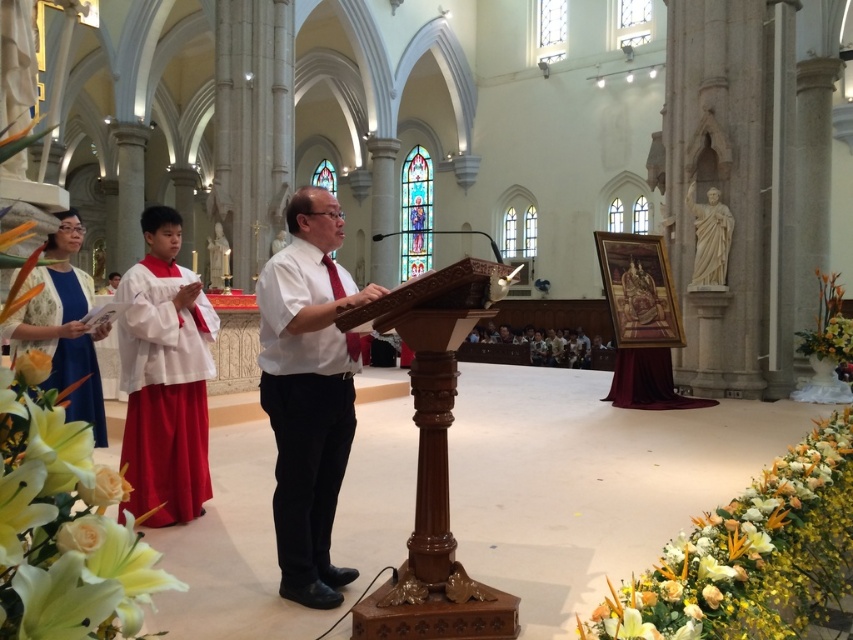
You are attending a ceremony in the grand church and notice two white items. The white cotton shirt at center and the white satin robe at left. Which one is positioned lower in the scene?

The white cotton shirt at center is located below the white satin robe at left, so it is positioned lower in the scene.

You are an attendee at the ceremony and want to hand a document to the person wearing the blue satin robe at lower left. You are currently standing near the brown polished wood podium at center. Can you directly approach them without moving around any objects?

The brown polished wood podium at center is closer to the viewer than the blue satin robe at lower left, so you would need to move around the podium to reach the blue satin robe at lower left.

You are standing in the grand church and need to place a 1.2 meter tall floral arrangement on an object. Which object between the brown polished wood podium at center and the blue satin robe at lower left can accommodate the height requirement?

The brown polished wood podium at center is much taller than the blue satin robe at lower left, so the floral arrangement can be placed on the brown polished wood podium at center as it meets the height requirement.